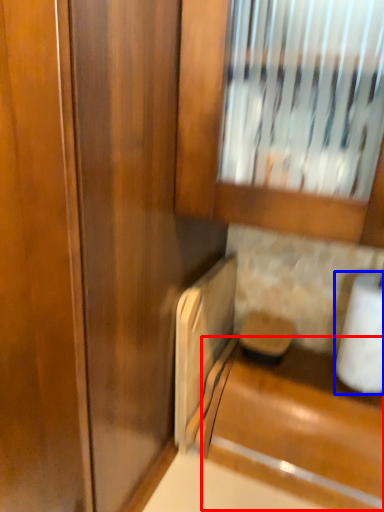
Question: Which point is closer to the camera, cabinetry (highlighted by a red box) or toilet paper (highlighted by a blue box)?

Choices:
 (A) cabinetry
 (B) toilet paper

Answer: (A)